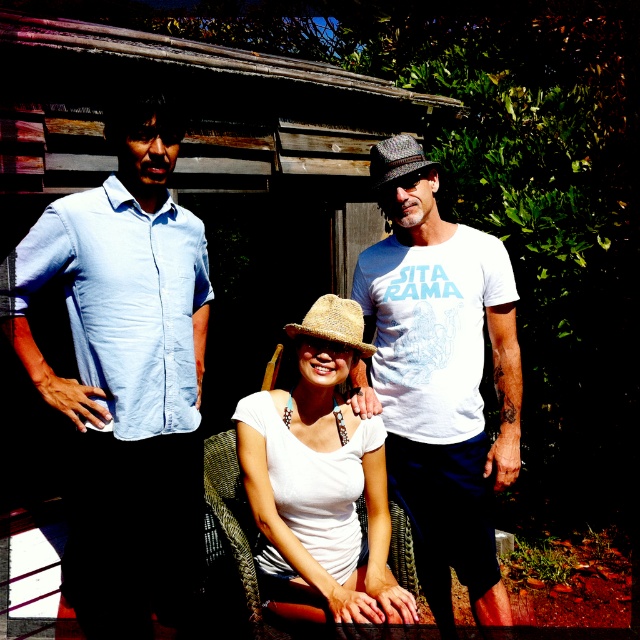
Question: Where is white cotton t-shirt at center located in relation to shiny metallic cowboy hat at center in the image?

Choices:
 (A) right
 (B) left

Answer: (A)

Question: Which object appears farthest from the camera in this image?

Choices:
 (A) white cotton t-shirt at center
 (B) white woven hat at center
 (C) shiny metallic cowboy hat at center

Answer: (A)

Question: Which object is positioned closest to the shiny metallic cowboy hat at center?

Choices:
 (A) light blue cotton shirt at left
 (B) white cotton t-shirt at center
 (C) strawmaterial/texturecowboy hat at center

Answer: (C)

Question: Which is nearer to the light blue cotton shirt at left?

Choices:
 (A) white cotton t-shirt at center
 (B) white woven hat at center
 (C) shiny metallic cowboy hat at center

Answer: (B)

Question: Can you confirm if light blue cotton shirt at left is positioned to the right of white cotton t-shirt at center?

Choices:
 (A) no
 (B) yes

Answer: (A)

Question: Does light blue cotton shirt at left have a larger size compared to shiny metallic cowboy hat at center?

Choices:
 (A) yes
 (B) no

Answer: (A)